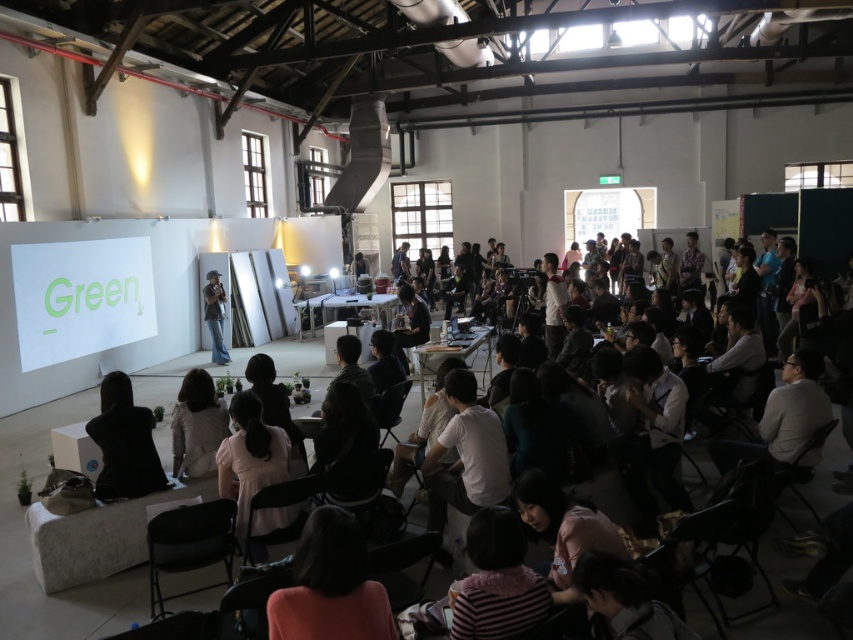
Is dark gray fabric jacket at center smaller than denim jeans at center?

Yes, dark gray fabric jacket at center is smaller than denim jeans at center.

Who is more forward, (357,384) or (210,301)?

Positioned in front is point (357,384).

The height and width of the screenshot is (640, 853). In order to click on dark gray fabric jacket at center in this screenshot , I will do `click(352, 368)`.

Can you confirm if black fabric at lower left is taller than denim jeans at center?

In fact, black fabric at lower left may be shorter than denim jeans at center.

Is point (117, 464) more distant than point (209, 314)?

No, it is in front of (209, 314).

Is point (103, 429) positioned after point (212, 348)?

No.

The height and width of the screenshot is (640, 853). What are the coordinates of `black fabric at lower left` in the screenshot? It's located at (125, 442).

Between light brown fabric jacket at lower center and dark gray fabric jacket at center, which one is positioned higher?

dark gray fabric jacket at center is higher up.

Which is in front, point (201, 433) or point (352, 364)?

Positioned in front is point (201, 433).

At what (x,y) coordinates should I click in order to perform the action: click on light brown fabric jacket at lower center. Please return your answer as a coordinate pair (x, y). The image size is (853, 640). Looking at the image, I should click on (196, 426).